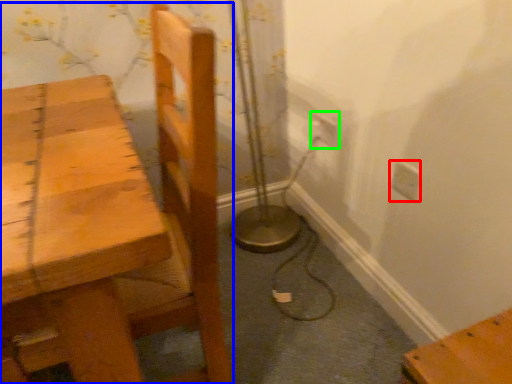
Question: Considering the real-world distances, which object is farthest from electric outlet (highlighted by a red box)? chair (highlighted by a blue box) or electric outlet (highlighted by a green box)?

Choices:
 (A) chair
 (B) electric outlet

Answer: (A)